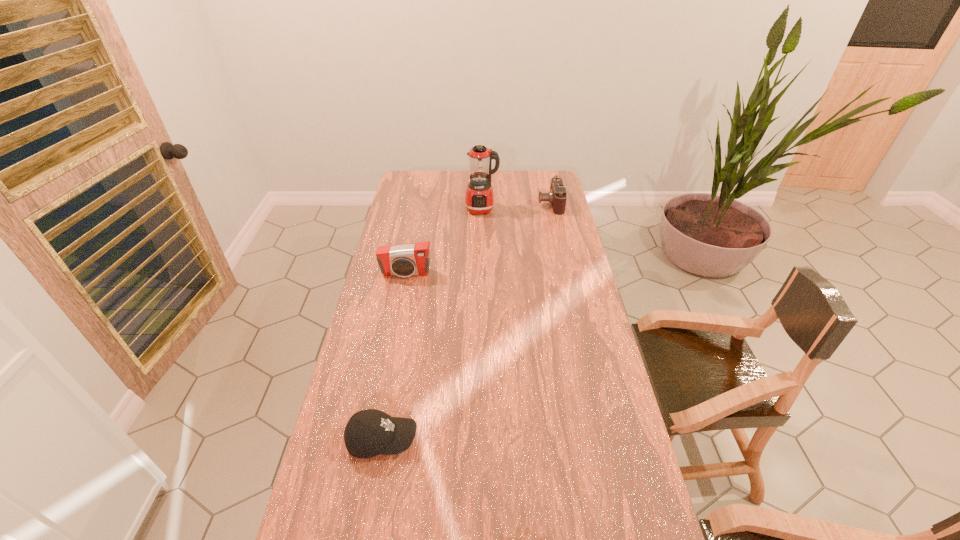
This screenshot has width=960, height=540. In order to click on vacant region at the right edge of the desktop in this screenshot , I will do `click(569, 272)`.

Find the location of a particular element. This screenshot has height=540, width=960. free space at the far left corner of the desktop is located at coordinates (432, 181).

Locate an element on the screen. free region at the far right corner of the desktop is located at coordinates (526, 171).

Find the location of a particular element. This screenshot has width=960, height=540. free space between the right camera and the baseball cap is located at coordinates (467, 321).

This screenshot has height=540, width=960. I want to click on unoccupied position between the taller camera and the right camera, so click(478, 239).

At what (x,y) coordinates should I click in order to perform the action: click on free space between the left camera and the tallest object. Please return your answer as a coordinate pair (x, y). The image size is (960, 540). Looking at the image, I should click on (444, 241).

The height and width of the screenshot is (540, 960). I want to click on free spot between the nearest object and the farther camera, so click(467, 321).

This screenshot has width=960, height=540. Identify the location of empty location between the right camera and the food processor. (516, 206).

Locate an element on the screen. Image resolution: width=960 pixels, height=540 pixels. object that is the second closest one to the taller camera is located at coordinates (370, 432).

Identify which object is located as the third nearest to the farther camera. Please provide its 2D coordinates. Your answer should be formatted as a tuple, i.e. [(x, y)], where the tuple contains the x and y coordinates of a point satisfying the conditions above.

[(370, 432)]